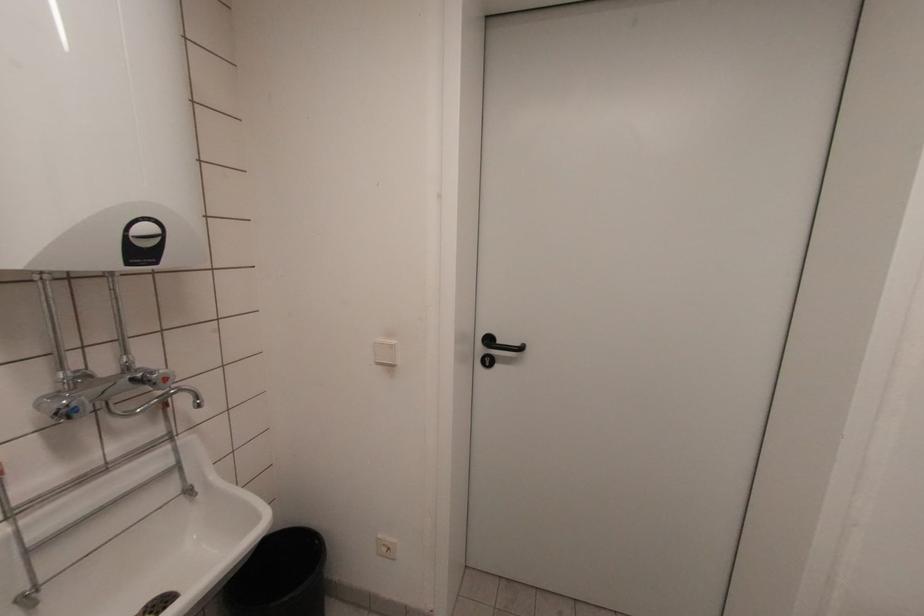
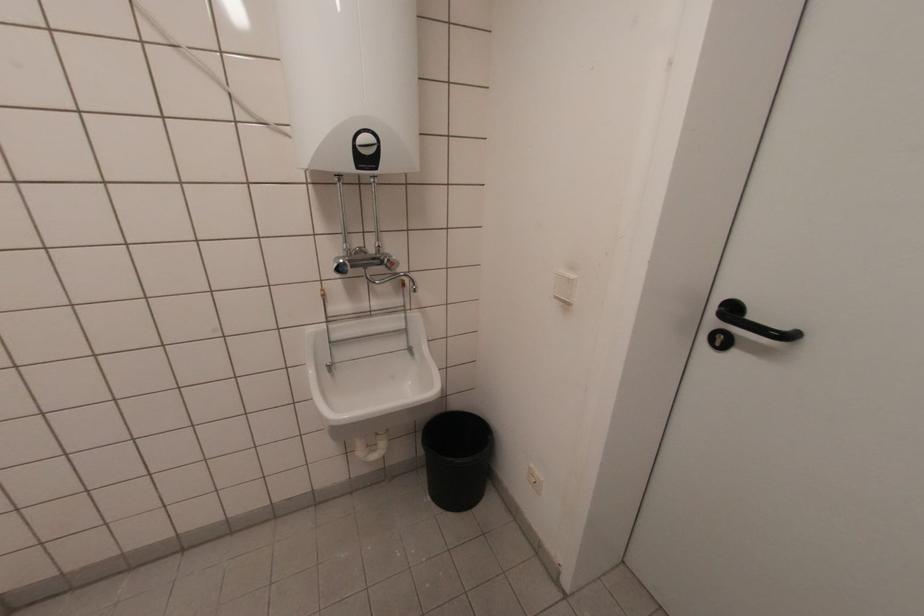
Question: I am providing you with two images of the same scene from different viewpoints. Please identify which objects are invisible in image2.

Choices:
 (A) black trash can
 (B) black door handle
 (C) water heater dial
 (D) none of these

Answer: (D)